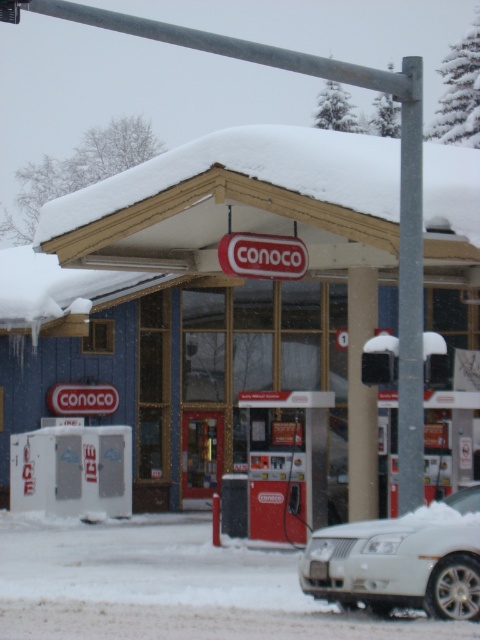
You are a driver who just arrived at the Conoco gas station. You need to park your car so that it doesn not block the entrance. Given the spatial relationship between the matte blue gas station at center and the white matte car at lower right, where should you park your car?

The matte blue gas station at center is taller than the white matte car at lower right. To avoid blocking the entrance, park your car behind the matte blue gas station at center so that the car is positioned away from the entrance area.

You are driving a white matte car at lower right and want to park it near the matte blue gas station at center. Given the size of the car and the gas station, will there be enough space to park the car without touching the gas station?

The matte blue gas station at center is bigger than the white matte car at lower right, so there should be enough space to park the car without touching the gas station.

You are standing at the entrance of the Conoco gas station and want to walk to a point located at coordinates point (x=153, y=440) and point (x=468, y=512). Which point is closer to you when you exit the entrance?

Point (x=153, y=440) is behind point (x=468, y=512), so the closer point to you when exiting the entrance would be point (x=468, y=512).